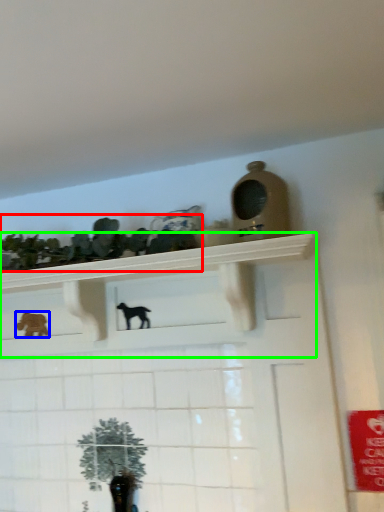
Question: Estimate the real-world distances between objects in this image. Which object is closer to collection (highlighted by a red box), animal (highlighted by a blue box) or shelf (highlighted by a green box)?

Choices:
 (A) animal
 (B) shelf

Answer: (B)